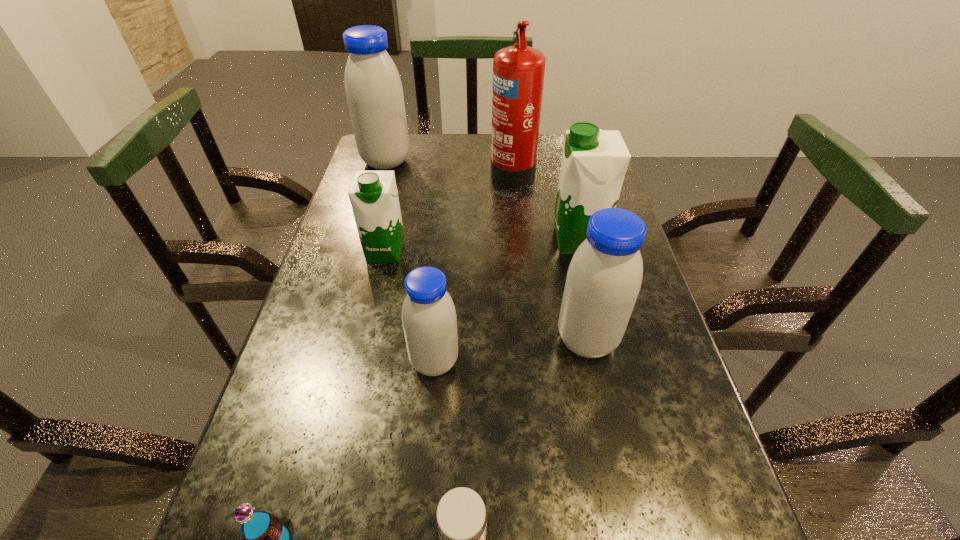
Locate an element on the screen. This screenshot has height=540, width=960. object located in the far left corner section of the desktop is located at coordinates (373, 87).

Identify the location of free space at the far edge. The height and width of the screenshot is (540, 960). (466, 150).

This screenshot has width=960, height=540. I want to click on blank space at the left edge of the desktop, so (237, 496).

Image resolution: width=960 pixels, height=540 pixels. In the image, there is a desktop. In order to click on vacant space at the right edge in this screenshot , I will do `click(618, 359)`.

Image resolution: width=960 pixels, height=540 pixels. In the image, there is a desktop. What are the coordinates of `free space at the far left corner` in the screenshot? It's located at (414, 148).

I want to click on vacant space that is in between the bigger green soya milk and the smaller green soya milk, so click(482, 246).

Where is `empty space that is in between the biggest blue soya milk and the rightmost blue soya milk`? This screenshot has width=960, height=540. empty space that is in between the biggest blue soya milk and the rightmost blue soya milk is located at coordinates (487, 251).

The height and width of the screenshot is (540, 960). Identify the location of vacant space that is in between the red fire extinguisher and the second tallest object. (449, 165).

I want to click on free spot between the rightmost blue soya milk and the second blue soya milk from left to right, so click(511, 351).

The width and height of the screenshot is (960, 540). In order to click on free area in between the red fire extinguisher and the second smallest blue soya milk in this screenshot , I will do `click(549, 255)`.